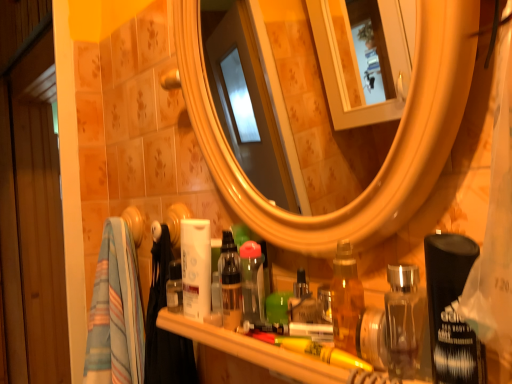
Where is `free spot in front of green plastic brush at center, the third toiletry positioned from the left`? The width and height of the screenshot is (512, 384). free spot in front of green plastic brush at center, the third toiletry positioned from the left is located at coordinates (304, 344).